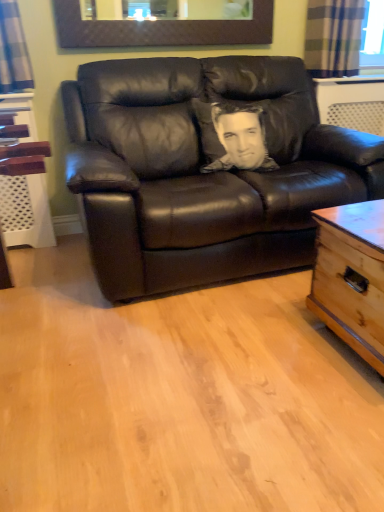
Question: Is matte brown picture frame at upper center wider or thinner than plaid fabric curtain at upper right?

Choices:
 (A) wide
 (B) thin

Answer: (B)

Question: Is point [102, 45] positioned closer to the camera than point [337, 13]?

Choices:
 (A) farther
 (B) closer

Answer: (B)

Question: Which of these objects is positioned farthest from the sepia-toned pillow at center?

Choices:
 (A) matte black leather couch at center
 (B) light brown wooden trunk at right
 (C) matte brown picture frame at upper center
 (D) plaid fabric curtain at upper right

Answer: (D)

Question: Which of these objects is positioned closest to the plaid fabric curtain at upper right?

Choices:
 (A) light brown wooden trunk at right
 (B) sepia-toned pillow at center
 (C) matte black leather couch at center
 (D) matte brown picture frame at upper center

Answer: (D)